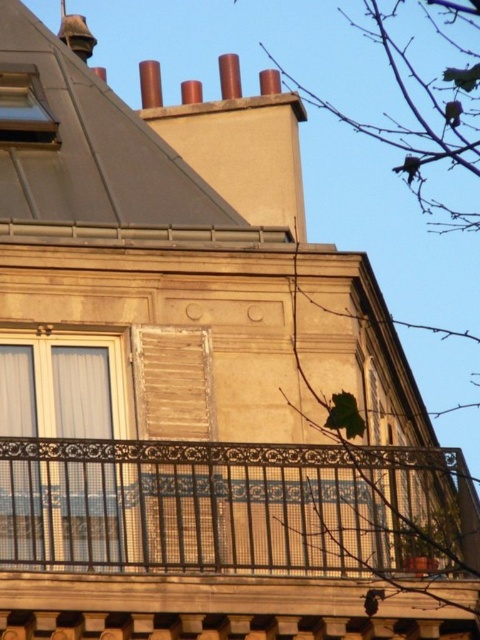
Is black wrought iron balcony at center taller than white glass window at left?

In fact, black wrought iron balcony at center may be shorter than white glass window at left.

Is black wrought iron balcony at center behind white glass window at left?

That is False.

Is point (151, 548) positioned before point (47, 444)?

That is False.

At what (x,y) coordinates should I click in order to perform the action: click on black wrought iron balcony at center. Please return your answer as a coordinate pair (x, y). Image resolution: width=480 pixels, height=640 pixels. Looking at the image, I should click on (231, 506).

Is white glass window at left thinner than matte glass window at upper left?

Incorrect, white glass window at left's width is not less than matte glass window at upper left's.

In order to click on white glass window at left in this screenshot , I will do `click(60, 449)`.

Is black wrought iron balcony at center taller than matte glass window at upper left?

Yes.

Locate an element on the screen. This screenshot has width=480, height=640. black wrought iron balcony at center is located at coordinates (231, 506).

In order to click on black wrought iron balcony at center in this screenshot , I will do `click(231, 506)`.